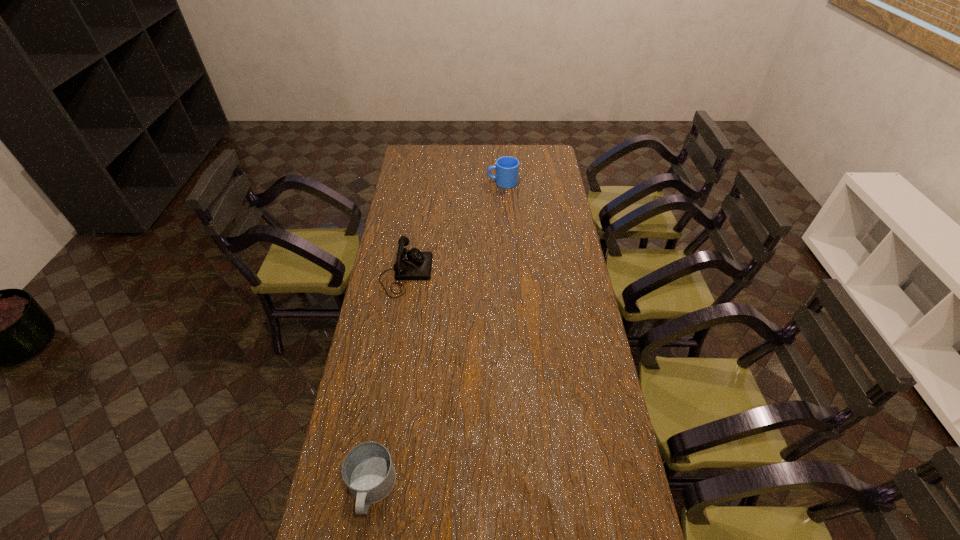
What are the coordinates of `the rightmost object` in the screenshot? It's located at (507, 168).

Where is `the farthest object`? the farthest object is located at coordinates (507, 168).

Image resolution: width=960 pixels, height=540 pixels. Identify the location of the second nearest object. (413, 264).

The height and width of the screenshot is (540, 960). What are the coordinates of `the nearest object` in the screenshot? It's located at click(367, 470).

The width and height of the screenshot is (960, 540). What are the coordinates of `the left mug` in the screenshot? It's located at (367, 470).

The height and width of the screenshot is (540, 960). In order to click on free location located 0.170m on the side of the farther mug with the handle in this screenshot , I will do `click(454, 183)`.

Where is `vacant area located 0.300m on the side of the farther mug with the handle`? This screenshot has width=960, height=540. vacant area located 0.300m on the side of the farther mug with the handle is located at coordinates (428, 183).

This screenshot has height=540, width=960. In order to click on free location located on the side of the farther mug with the handle in this screenshot , I will do `click(438, 183)`.

Where is `vacant space situated 0.090m on the front face of the telephone`? The height and width of the screenshot is (540, 960). vacant space situated 0.090m on the front face of the telephone is located at coordinates (453, 273).

Identify the location of telephone that is at the left edge. The image size is (960, 540). (413, 264).